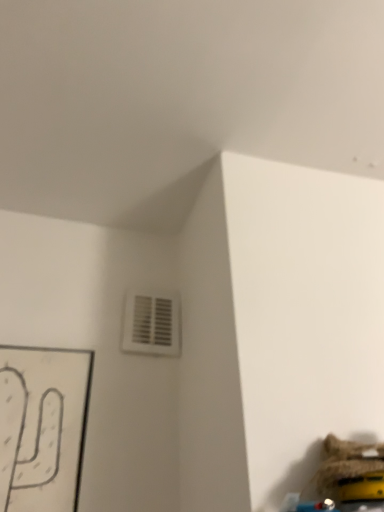
Describe the element at coordinates (342, 477) in the screenshot. I see `fuzzy fabric toy at lower right` at that location.

What is the approximate width of fuzzy fabric toy at lower right?

The width of fuzzy fabric toy at lower right is 4.50 inches.

The width and height of the screenshot is (384, 512). In order to click on fuzzy fabric toy at lower right in this screenshot , I will do `click(342, 477)`.

Identify the location of white plastic vent at upper center. (152, 324).

What do you see at coordinates (152, 324) in the screenshot?
I see `white plastic vent at upper center` at bounding box center [152, 324].

In order to face white plastic vent at upper center, should I rotate leftwards or rightwards?

Rotate left and turn 5.548 degrees.

What is the approximate height of white plastic vent at upper center?

It is 6.17 inches.

This screenshot has width=384, height=512. In order to click on fuzzy fabric toy at lower right in this screenshot , I will do `click(342, 477)`.

Considering the positions of objects fuzzy fabric toy at lower right and white plastic vent at upper center in the image provided, who is more to the right, fuzzy fabric toy at lower right or white plastic vent at upper center?

fuzzy fabric toy at lower right is more to the right.

Between fuzzy fabric toy at lower right and white plastic vent at upper center, which one is positioned behind?

white plastic vent at upper center is more distant.

Does point (357, 442) come farther from viewer compared to point (168, 306)?

No.

From the image's perspective, is fuzzy fabric toy at lower right over white plastic vent at upper center?

No, from the image's perspective, fuzzy fabric toy at lower right is not above white plastic vent at upper center.

From a real-world perspective, does fuzzy fabric toy at lower right stand above white plastic vent at upper center?

No, from a real-world perspective, fuzzy fabric toy at lower right is not on top of white plastic vent at upper center.

Between fuzzy fabric toy at lower right and white plastic vent at upper center, which one has smaller width?

With smaller width is white plastic vent at upper center.

Does fuzzy fabric toy at lower right have a greater height compared to white plastic vent at upper center?

In fact, fuzzy fabric toy at lower right may be shorter than white plastic vent at upper center.

Does fuzzy fabric toy at lower right have a smaller size compared to white plastic vent at upper center?

No, fuzzy fabric toy at lower right is not smaller than white plastic vent at upper center.

Choose the correct answer: Is fuzzy fabric toy at lower right inside white plastic vent at upper center or outside it?

fuzzy fabric toy at lower right is spatially situated outside white plastic vent at upper center.

Are fuzzy fabric toy at lower right and white plastic vent at upper center making contact?

No, fuzzy fabric toy at lower right is not making contact with white plastic vent at upper center.

Is fuzzy fabric toy at lower right positioned with its back to white plastic vent at upper center?

No, fuzzy fabric toy at lower right is not facing away from white plastic vent at upper center.

How much distance is there between fuzzy fabric toy at lower right and white plastic vent at upper center?

fuzzy fabric toy at lower right is 19.61 inches from white plastic vent at upper center.

In order to click on air conditioning above the fuzzy fabric toy at lower right (from a real-world perspective) in this screenshot , I will do `click(152, 324)`.

Is white plastic vent at upper center to the right of fuzzy fabric toy at lower right from the viewer's perspective?

Incorrect, white plastic vent at upper center is not on the right side of fuzzy fabric toy at lower right.

Which is in front, white plastic vent at upper center or fuzzy fabric toy at lower right?

fuzzy fabric toy at lower right is closer to the camera.

Considering the positions of points (170, 313) and (366, 448), is point (170, 313) farther from camera compared to point (366, 448)?

Yes, it is behind point (366, 448).

From the image's perspective, between white plastic vent at upper center and fuzzy fabric toy at lower right, which one is located above?

From the image's view, white plastic vent at upper center is above.

From a real-world perspective, who is located higher, white plastic vent at upper center or fuzzy fabric toy at lower right?

In real-world perspective, white plastic vent at upper center is above.

Is white plastic vent at upper center thinner than fuzzy fabric toy at lower right?

Indeed, white plastic vent at upper center has a lesser width compared to fuzzy fabric toy at lower right.

Does white plastic vent at upper center have a greater height compared to fuzzy fabric toy at lower right?

Indeed, white plastic vent at upper center has a greater height compared to fuzzy fabric toy at lower right.

Considering the sizes of objects white plastic vent at upper center and fuzzy fabric toy at lower right in the image provided, who is smaller, white plastic vent at upper center or fuzzy fabric toy at lower right?

With smaller size is white plastic vent at upper center.

Is fuzzy fabric toy at lower right completely or partially inside white plastic vent at upper center?

That's incorrect, fuzzy fabric toy at lower right is not inside white plastic vent at upper center.

Is white plastic vent at upper center directly adjacent to fuzzy fabric toy at lower right?

white plastic vent at upper center is not next to fuzzy fabric toy at lower right, and they're not touching.

Is fuzzy fabric toy at lower right at the back of white plastic vent at upper center?

No.

You are a GUI agent. You are given a task and a screenshot of the screen. Output one action in this format:
    pyautogui.click(x=<x>, y=<y>)
    Task: Click on the toy below the white plastic vent at upper center (from a real-world perspective)
    Image resolution: width=384 pixels, height=512 pixels.
    Given the screenshot: What is the action you would take?
    pyautogui.click(x=342, y=477)

The width and height of the screenshot is (384, 512). What are the coordinates of `air conditioning above the fuzzy fabric toy at lower right (from the image's perspective)` in the screenshot? It's located at (152, 324).

Image resolution: width=384 pixels, height=512 pixels. What are the coordinates of `air conditioning above the fuzzy fabric toy at lower right (from a real-world perspective)` in the screenshot? It's located at (152, 324).